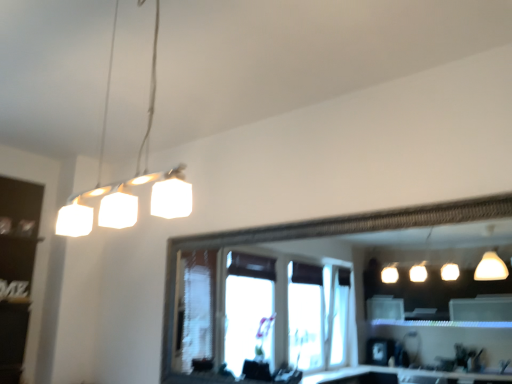
Question: Considering the positions of black matte shelf at left and white matte cube at upper left in the image, is black matte shelf at left wider or thinner than white matte cube at upper left?

Choices:
 (A) wide
 (B) thin

Answer: (A)

Question: From a real-world perspective, is black matte shelf at left above or below white matte cube at upper left?

Choices:
 (A) above
 (B) below

Answer: (B)

Question: From the image's perspective, is black matte shelf at left positioned above or below white matte cube at upper left?

Choices:
 (A) below
 (B) above

Answer: (A)

Question: From the image's perspective, is white matte cube at upper left located above or below black matte shelf at left?

Choices:
 (A) above
 (B) below

Answer: (A)

Question: Looking at their shapes, would you say white matte cube at upper left is wider or thinner than black matte shelf at left?

Choices:
 (A) thin
 (B) wide

Answer: (A)

Question: Considering the positions of white matte cube at upper left and black matte shelf at left in the image, is white matte cube at upper left bigger or smaller than black matte shelf at left?

Choices:
 (A) big
 (B) small

Answer: (B)

Question: Would you say white matte cube at upper left is to the left or to the right of black matte shelf at left in the picture?

Choices:
 (A) right
 (B) left

Answer: (A)